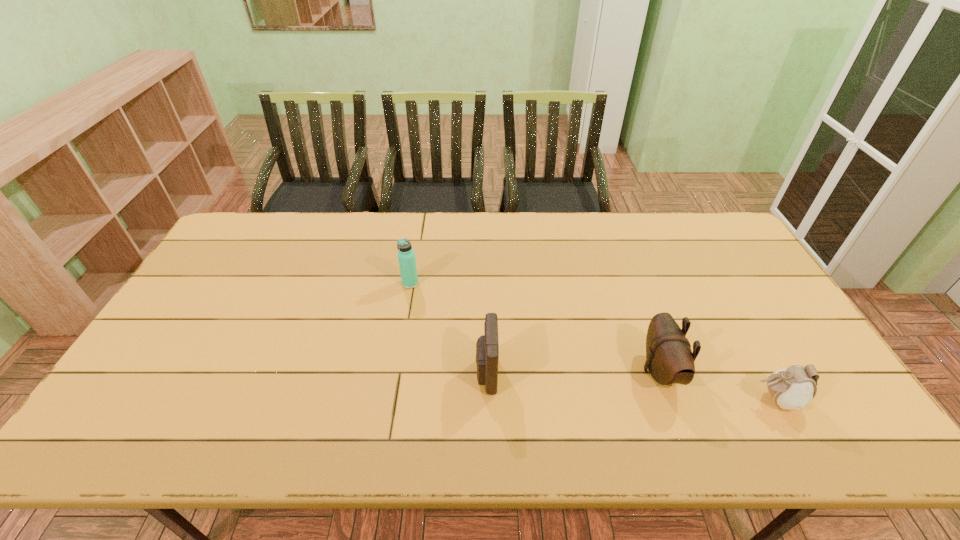
The height and width of the screenshot is (540, 960). Find the location of `empty space between the second pouch from left to right and the rightmost pouch`. empty space between the second pouch from left to right and the rightmost pouch is located at coordinates (718, 385).

The image size is (960, 540). Identify the location of vacant space in between the third object from left to right and the rightmost object. (718, 385).

The image size is (960, 540). I want to click on vacant point located between the shortest object and the leftmost object, so click(x=593, y=341).

Where is `unoccupied area between the second object from right to left and the rightmost object`? The height and width of the screenshot is (540, 960). unoccupied area between the second object from right to left and the rightmost object is located at coordinates (718, 385).

I want to click on vacant area between the second object from right to left and the leftmost object, so click(x=535, y=327).

Select which object is the third closest to the shortest pouch. Please provide its 2D coordinates. Your answer should be formatted as a tuple, i.e. [(x, y)], where the tuple contains the x and y coordinates of a point satisfying the conditions above.

[(406, 256)]

Choose which object is the second nearest neighbor to the second object from left to right. Please provide its 2D coordinates. Your answer should be formatted as a tuple, i.e. [(x, y)], where the tuple contains the x and y coordinates of a point satisfying the conditions above.

[(669, 358)]

Identify which pouch is the closest to the thermos bottle. Please provide its 2D coordinates. Your answer should be formatted as a tuple, i.e. [(x, y)], where the tuple contains the x and y coordinates of a point satisfying the conditions above.

[(487, 347)]

Find the location of a particular element. This screenshot has width=960, height=540. pouch that can be found as the second closest to the second pouch from left to right is located at coordinates (487, 347).